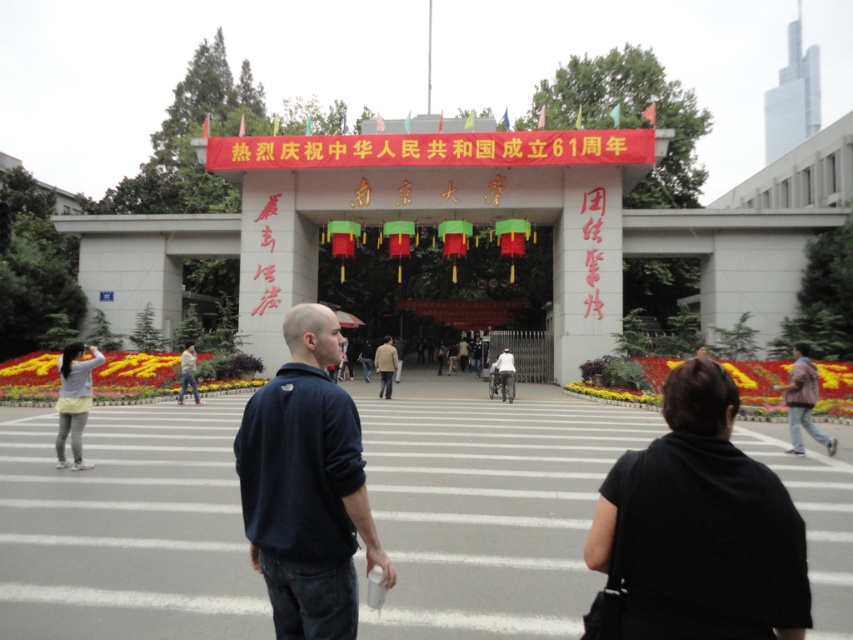
Which is more to the right, dark blue fleece at center or light brown leather jacket at center?

Positioned to the right is dark blue fleece at center.

Looking at this image, does dark blue fleece at center appear on the left side of light brown leather jacket at center?

In fact, dark blue fleece at center is to the right of light brown leather jacket at center.

Identify the location of dark blue fleece at center. (306, 484).

Does brown leather jacket at lower right appear on the left side of light brown leather jacket at center?

In fact, brown leather jacket at lower right is to the right of light brown leather jacket at center.

Is point (796, 342) closer to camera compared to point (390, 340)?

No, it is not.

Which is behind, point (782, 390) or point (378, 358)?

Positioned behind is point (378, 358).

The height and width of the screenshot is (640, 853). In order to click on brown leather jacket at lower right in this screenshot , I will do `click(802, 401)`.

At what (x,y) coordinates should I click in order to perform the action: click on dark blue fleece at center. Please return your answer as a coordinate pair (x, y). This screenshot has width=853, height=640. Looking at the image, I should click on (306, 484).

How much distance is there between dark blue fleece at center and brown leather jacket at lower right?

dark blue fleece at center is 41.72 feet away from brown leather jacket at lower right.

What do you see at coordinates (306, 484) in the screenshot? I see `dark blue fleece at center` at bounding box center [306, 484].

This screenshot has height=640, width=853. In order to click on dark blue fleece at center in this screenshot , I will do `click(306, 484)`.